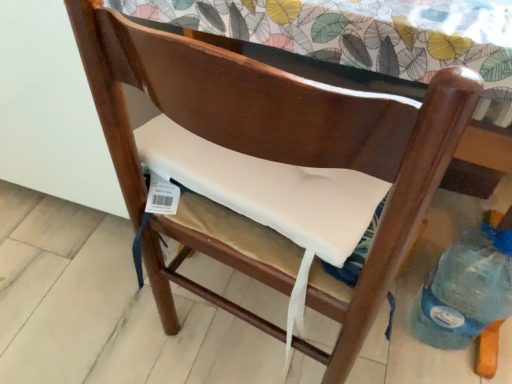
In order to face blue plastic bottle at lower right, should I rotate leftwards or rightwards?

To face it directly, rotate right by 27.633 degrees.

Measure the distance between point [431,282] and camera.

A distance of 38.50 inches exists between point [431,282] and camera.

This screenshot has height=384, width=512. I want to click on blue plastic bottle at lower right, so pos(466,290).

The width and height of the screenshot is (512, 384). Describe the element at coordinates (466, 290) in the screenshot. I see `blue plastic bottle at lower right` at that location.

This screenshot has height=384, width=512. Find the location of `blue plastic bottle at lower right`. blue plastic bottle at lower right is located at coordinates (466, 290).